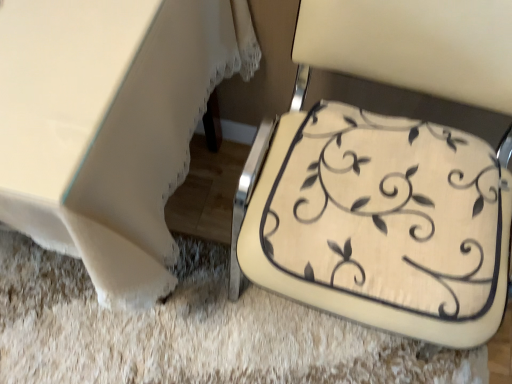
Question: Is beige fabric cushion at lower right at the left side of white fabric table at lower left?

Choices:
 (A) no
 (B) yes

Answer: (A)

Question: From a real-world perspective, is beige fabric cushion at lower right physically below white fabric table at lower left?

Choices:
 (A) no
 (B) yes

Answer: (A)

Question: Does beige fabric cushion at lower right contain white fabric table at lower left?

Choices:
 (A) no
 (B) yes

Answer: (A)

Question: From a real-world perspective, is beige fabric cushion at lower right located higher than white fabric table at lower left?

Choices:
 (A) yes
 (B) no

Answer: (A)

Question: From the image's perspective, is beige fabric cushion at lower right located beneath white fabric table at lower left?

Choices:
 (A) yes
 (B) no

Answer: (A)

Question: Is beige fabric cushion at lower right outside of white fabric table at lower left?

Choices:
 (A) no
 (B) yes

Answer: (B)

Question: Can you confirm if white fabric table at lower left is taller than beige fabric cushion at lower right?

Choices:
 (A) no
 (B) yes

Answer: (A)

Question: Is white fabric table at lower left touching beige fabric cushion at lower right?

Choices:
 (A) no
 (B) yes

Answer: (A)

Question: Is white fabric table at lower left facing away from beige fabric cushion at lower right?

Choices:
 (A) yes
 (B) no

Answer: (B)

Question: Can you confirm if white fabric table at lower left is bigger than beige fabric cushion at lower right?

Choices:
 (A) yes
 (B) no

Answer: (A)

Question: From a real-world perspective, is white fabric table at lower left physically below beige fabric cushion at lower right?

Choices:
 (A) no
 (B) yes

Answer: (B)

Question: Is white fabric table at lower left thinner than beige fabric cushion at lower right?

Choices:
 (A) no
 (B) yes

Answer: (A)

Question: Would you say beige fabric cushion at lower right is inside or outside white fabric table at lower left?

Choices:
 (A) inside
 (B) outside

Answer: (B)